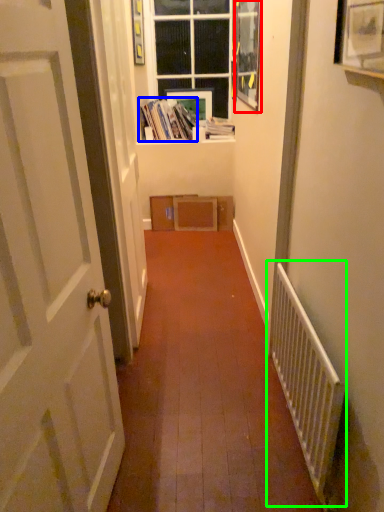
Question: Which is nearer to the picture frame (highlighted by a red box)? book (highlighted by a blue box) or radiator (highlighted by a green box).

Choices:
 (A) book
 (B) radiator

Answer: (A)